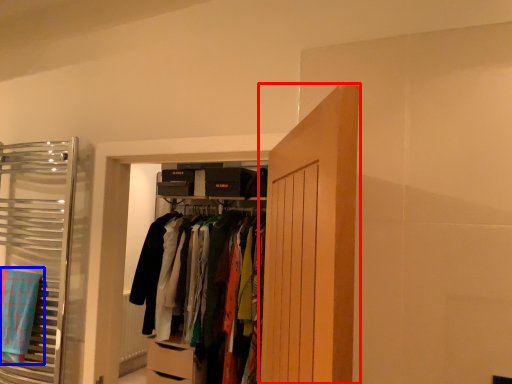
Question: Among these objects, which one is nearest to the camera, door (highlighted by a red box) or bath towel (highlighted by a blue box)?

Choices:
 (A) door
 (B) bath towel

Answer: (A)